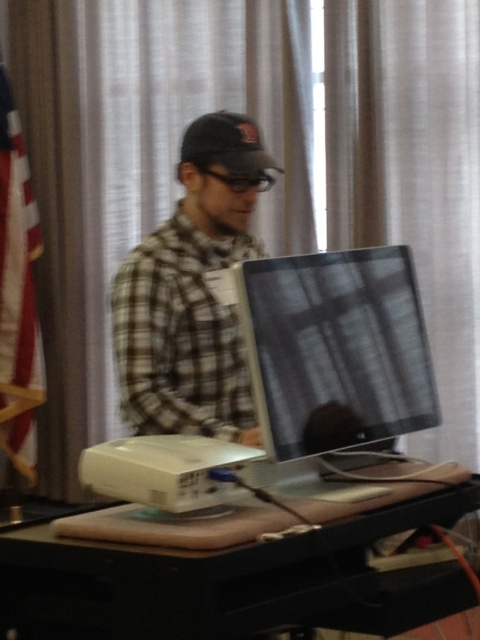
You are a person sitting at the desk in the image. You notice two points marked in the scene. One is at point coordinates point (25, 595) and the other is at point (226, 339). Which point is closer to you?

Point (25, 595) is in front of point (226, 339), so the point at point (25, 595) is closer to you.

You are a photographer taking a portrait of the person wearing the dark gray matte baseball cap at center. The matte black monitor at center is blocking your view. Can you move the monitor to get a clear shot of the cap?

The matte black monitor at center is closer to the viewer than the dark gray matte baseball cap at center, so moving the matte black monitor at center would allow you to see the dark gray matte baseball cap at center clearly.

You are setting up a presentation and need to adjust the angle of the matte black monitor at center so that it faces the audience. Since the dark gray matte baseball cap at center is in the way, can you move the monitor without moving the cap?

The matte black monitor at center is positioned under the dark gray matte baseball cap at center, so moving the monitor would require adjusting its position below the cap, which might still allow it to face the audience without necessarily moving the cap itself.